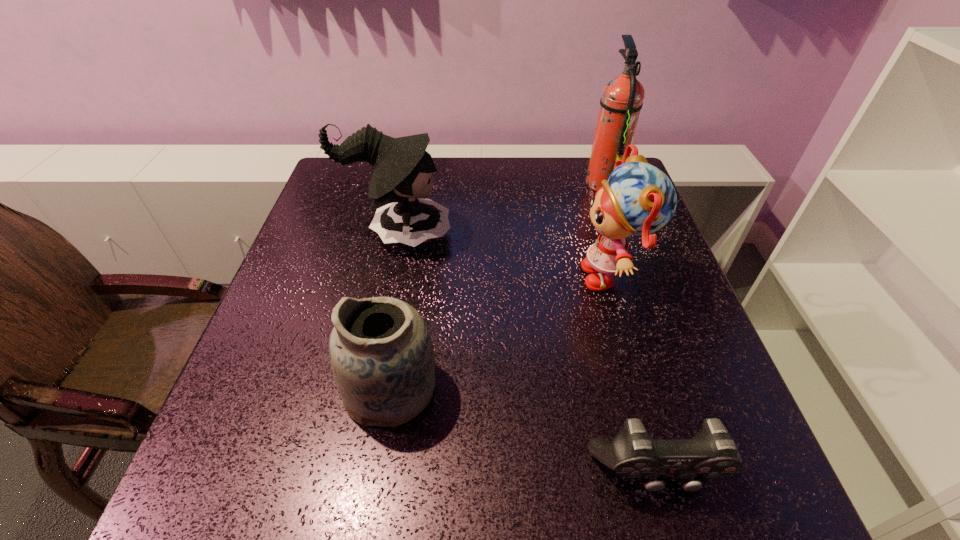
Where is `free location that satisfies the following two spatial constraints: 1. at the nozzle of the tallest object; 2. on the surface of the nearest object with buttons`? free location that satisfies the following two spatial constraints: 1. at the nozzle of the tallest object; 2. on the surface of the nearest object with buttons is located at coordinates (706, 472).

You are a GUI agent. You are given a task and a screenshot of the screen. Output one action in this format:
    pyautogui.click(x=<x>, y=<y>)
    Task: Click on the vacant space that satisfies the following two spatial constraints: 1. on the face of the right doll; 2. on the surface of the shortest object with buttons
    The image size is (960, 540).
    Given the screenshot: What is the action you would take?
    [671, 472]

In order to click on vacant region that satisfies the following two spatial constraints: 1. on the face of the right doll; 2. on the surface of the shortest object with buttons in this screenshot , I will do `click(671, 472)`.